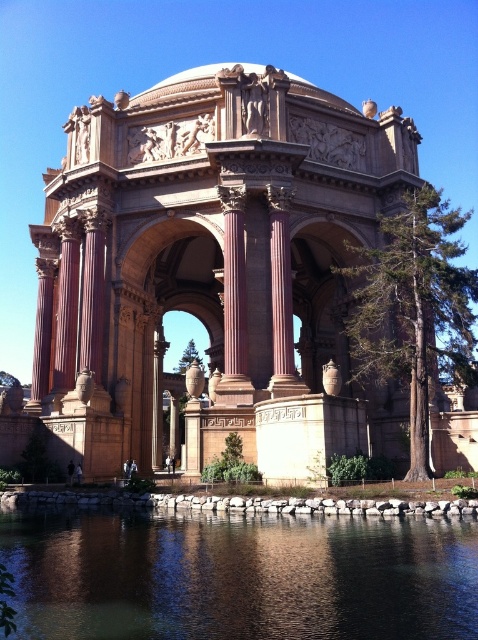
Which is more to the left, beige stone palace at center or transparent water at lower center?

transparent water at lower center is more to the left.

Does beige stone palace at center come in front of transparent water at lower center?

No, it is behind transparent water at lower center.

Is point (61, 273) more distant than point (144, 625)?

Yes, point (61, 273) is behind point (144, 625).

The height and width of the screenshot is (640, 478). In order to click on beige stone palace at center in this screenshot , I will do `click(209, 269)`.